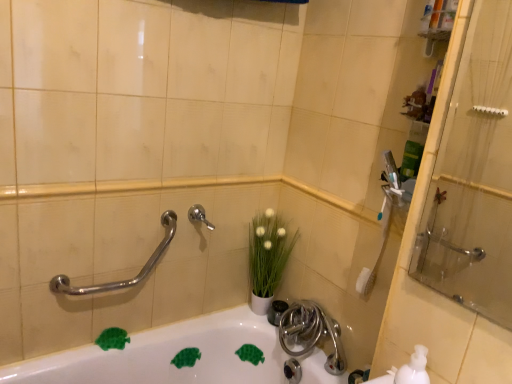
Where is `vacant area situated to the left side of white matte vase at center`? The width and height of the screenshot is (512, 384). vacant area situated to the left side of white matte vase at center is located at coordinates (226, 313).